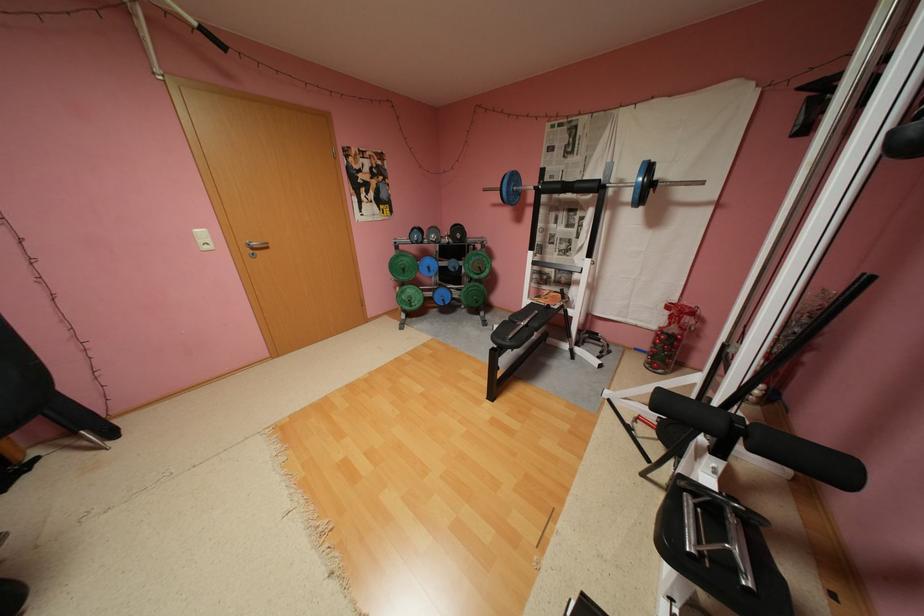
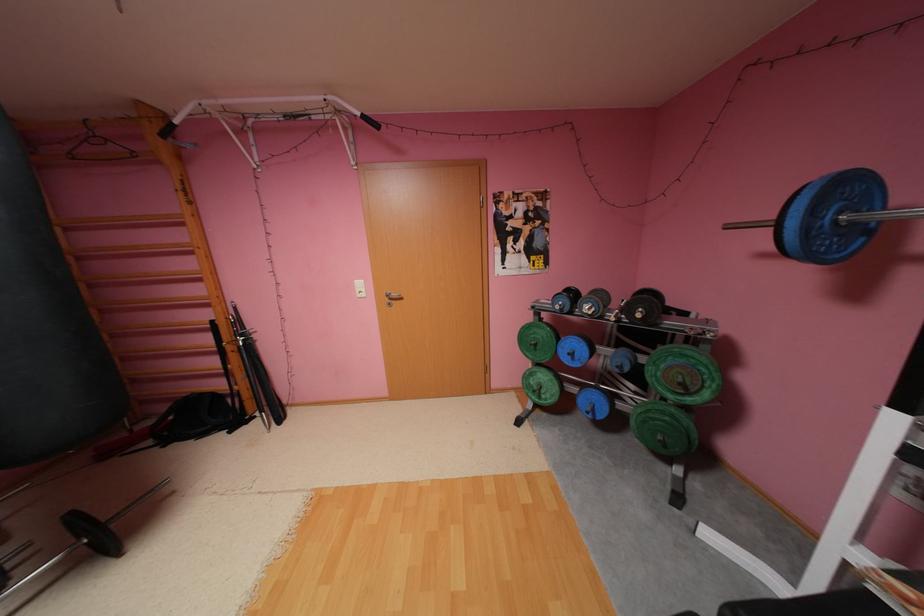
Find the pixel in the second image that matches point (438, 268) in the first image.

(580, 354)